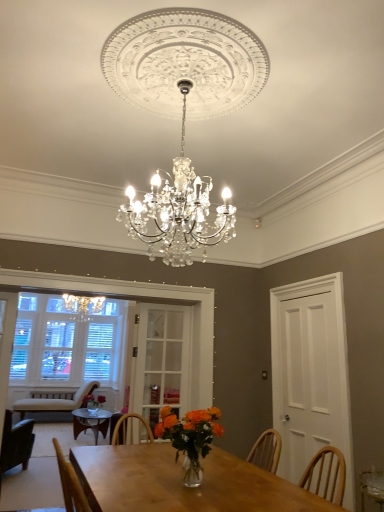
Describe the element at coordinates (190, 438) in the screenshot. I see `translucent glass vase at center` at that location.

The image size is (384, 512). Find the location of `dark green fabric chair at left, the 2th chair from the back`. dark green fabric chair at left, the 2th chair from the back is located at coordinates (16, 443).

This screenshot has height=512, width=384. What do you see at coordinates (16, 443) in the screenshot?
I see `dark green fabric chair at left, the 1th chair viewed from the top` at bounding box center [16, 443].

What is the approximate height of clear glass door at center, which appears as the first glass door when viewed from the left?

1.46 meters.

Locate an element on the screen. The image size is (384, 512). beige fabric chair at left, which ranks as the first chair in back-to-front order is located at coordinates (54, 401).

At what (x,y) coordinates should I click in order to perform the action: click on translucent glass vase at center. Please return your answer as a coordinate pair (x, y). The height and width of the screenshot is (512, 384). Looking at the image, I should click on (190, 438).

Is beige fabric chair at left, which is the first chair in bottom-to-top order, inside translucent glass vase at center?

That's incorrect, beige fabric chair at left, which is the first chair in bottom-to-top order, is not inside translucent glass vase at center.

From their relative heights in the image, would you say translucent glass vase at center is taller or shorter than beige fabric chair at left, which is counted as the second chair, starting from the top?

translucent glass vase at center is shorter than beige fabric chair at left, which is counted as the second chair, starting from the top.

Image resolution: width=384 pixels, height=512 pixels. In order to click on floral arrangement above the beige fabric chair at left, acting as the 2th chair starting from the front (from a real-world perspective) in this screenshot , I will do `click(190, 438)`.

Can you tell me how much translucent glass vase at center and beige fabric chair at left, which ranks as the first chair in back-to-front order, differ in facing direction?

179 degrees.

Visually, is white wood door at right, positioned as the second glass door in left-to-right order, positioned to the left or to the right of beige fabric chair at left, which is the first chair in bottom-to-top order?

Based on their positions, white wood door at right, positioned as the second glass door in left-to-right order, is located to the right of beige fabric chair at left, which is the first chair in bottom-to-top order.

Between point (284, 432) and point (33, 394), which one is positioned in front?

The point (284, 432) is closer to the camera.

Which object is wider, white wood door at right, positioned as the second glass door in left-to-right order, or beige fabric chair at left, which is counted as the second chair, starting from the top?

beige fabric chair at left, which is counted as the second chair, starting from the top.

From the picture: Are white wood door at right, positioned as the second glass door in left-to-right order, and beige fabric chair at left, which is counted as the second chair, starting from the top, located far from each other?

Yes, white wood door at right, positioned as the second glass door in left-to-right order, is far from beige fabric chair at left, which is counted as the second chair, starting from the top.

From the image's perspective, relative to dark green fabric chair at left, the 2th chair when ordered from bottom to top, is white wood door at right, placed as the 1th glass door when sorted from right to left, above or below?

white wood door at right, placed as the 1th glass door when sorted from right to left, is situated higher than dark green fabric chair at left, the 2th chair when ordered from bottom to top, in the image.

What's the angular difference between white wood door at right, positioned as the second glass door in left-to-right order, and dark green fabric chair at left, which appears as the first chair when viewed from the front,'s facing directions?

white wood door at right, positioned as the second glass door in left-to-right order, and dark green fabric chair at left, which appears as the first chair when viewed from the front, are facing 116 degrees away from each other.

Does point (348, 446) come in front of point (20, 459)?

Yes, point (348, 446) is in front of point (20, 459).

Which is more to the right, white wood door at right, positioned as the second glass door in left-to-right order, or dark green fabric chair at left, the 2th chair when ordered from bottom to top?

white wood door at right, positioned as the second glass door in left-to-right order, is more to the right.

From a real-world perspective, is clear glass door at center, which appears as the first glass door when viewed from the left, located higher than translucent glass vase at center?

Indeed, from a real-world perspective, clear glass door at center, which appears as the first glass door when viewed from the left, stands above translucent glass vase at center.

In the scene shown: Which object is closer to the camera taking this photo, clear glass door at center, which appears as the first glass door when viewed from the left, or translucent glass vase at center?

translucent glass vase at center is closer to the camera.

Is point (177, 407) positioned before point (199, 420)?

No, (177, 407) is behind (199, 420).

Considering the sizes of objects clear glass door at center, which appears as the first glass door when viewed from the left, and translucent glass vase at center in the image provided, who is taller, clear glass door at center, which appears as the first glass door when viewed from the left, or translucent glass vase at center?

clear glass door at center, which appears as the first glass door when viewed from the left.

In the scene shown: Considering the relative sizes of dark green fabric chair at left, the 2th chair from the back, and clear glass door at center, which appears as the first glass door when viewed from the left, in the image provided, is dark green fabric chair at left, the 2th chair from the back, bigger than clear glass door at center, which appears as the first glass door when viewed from the left,?

Indeed, dark green fabric chair at left, the 2th chair from the back, has a larger size compared to clear glass door at center, which appears as the first glass door when viewed from the left.

Is dark green fabric chair at left, the 1th chair viewed from the top, closer to the viewer compared to clear glass door at center, which appears as the 2th glass door when viewed from the right?

No, dark green fabric chair at left, the 1th chair viewed from the top, is behind clear glass door at center, which appears as the 2th glass door when viewed from the right.

From a real-world perspective, who is located higher, dark green fabric chair at left, the 2th chair from the back, or clear glass door at center, which appears as the 2th glass door when viewed from the right?

clear glass door at center, which appears as the 2th glass door when viewed from the right.

Is the surface of dark green fabric chair at left, the 2th chair from the back, in direct contact with clear glass door at center, which appears as the 2th glass door when viewed from the right?

dark green fabric chair at left, the 2th chair from the back, is not next to clear glass door at center, which appears as the 2th glass door when viewed from the right, and they're not touching.

Considering the relative sizes of dark green fabric chair at left, the 1th chair viewed from the top, and beige fabric chair at left, which ranks as the first chair in back-to-front order, in the image provided, is dark green fabric chair at left, the 1th chair viewed from the top, bigger than beige fabric chair at left, which ranks as the first chair in back-to-front order,?

No.

From a real-world perspective, is dark green fabric chair at left, the 2th chair when ordered from bottom to top, positioned above or below beige fabric chair at left, which is counted as the second chair, starting from the top?

dark green fabric chair at left, the 2th chair when ordered from bottom to top, is above beige fabric chair at left, which is counted as the second chair, starting from the top.

Considering the positions of points (24, 431) and (76, 405), is point (24, 431) farther from camera compared to point (76, 405)?

That is False.

Is dark green fabric chair at left, the 2th chair when ordered from bottom to top, taller or shorter than beige fabric chair at left, which is counted as the second chair, starting from the top?

In the image, dark green fabric chair at left, the 2th chair when ordered from bottom to top, appears to be taller than beige fabric chair at left, which is counted as the second chair, starting from the top.

From the image's perspective, who appears lower, beige fabric chair at left, which is the first chair in bottom-to-top order, or clear glass door at center, which appears as the 2th glass door when viewed from the right?

beige fabric chair at left, which is the first chair in bottom-to-top order, from the image's perspective.

Between beige fabric chair at left, acting as the 2th chair starting from the front, and clear glass door at center, which appears as the first glass door when viewed from the left, which one has smaller width?

clear glass door at center, which appears as the first glass door when viewed from the left.

In the scene shown: Is the position of beige fabric chair at left, acting as the 2th chair starting from the front, more distant than that of clear glass door at center, which appears as the 2th glass door when viewed from the right?

Yes, it is.

Are beige fabric chair at left, acting as the 2th chair starting from the front, and clear glass door at center, which appears as the 2th glass door when viewed from the right, located far from each other?

beige fabric chair at left, acting as the 2th chair starting from the front, is positioned a significant distance from clear glass door at center, which appears as the 2th glass door when viewed from the right.

Locate an element on the screen. floral arrangement in front of the beige fabric chair at left, which ranks as the first chair in back-to-front order is located at coordinates (190, 438).

There is a beige fabric chair at left, which is the first chair in bottom-to-top order. At what (x,y) coordinates should I click in order to perform the action: click on the 2nd glass door above it (from the image's perspective). Please return your answer as a coordinate pair (x, y). The image size is (384, 512). Looking at the image, I should click on (311, 375).

Which object lies further to the anchor point translucent glass vase at center, beige fabric chair at left, acting as the 2th chair starting from the front, or white wood door at right, placed as the 1th glass door when sorted from right to left?

Among the two, beige fabric chair at left, acting as the 2th chair starting from the front, is located further to translucent glass vase at center.

Based on their spatial positions, is dark green fabric chair at left, which appears as the first chair when viewed from the front, or beige fabric chair at left, which ranks as the first chair in back-to-front order, further from clear glass door at center, which appears as the 2th glass door when viewed from the right?

Based on the image, beige fabric chair at left, which ranks as the first chair in back-to-front order, appears to be further to clear glass door at center, which appears as the 2th glass door when viewed from the right.

Considering their positions, is beige fabric chair at left, which is counted as the second chair, starting from the top, positioned further to dark green fabric chair at left, the 2th chair from the back, than clear glass door at center, which appears as the first glass door when viewed from the left?

The object further to dark green fabric chair at left, the 2th chair from the back, is clear glass door at center, which appears as the first glass door when viewed from the left.

Estimate the real-world distances between objects in this image. Which object is closer to clear glass door at center, which appears as the first glass door when viewed from the left, beige fabric chair at left, which is counted as the second chair, starting from the top, or white wood door at right, positioned as the second glass door in left-to-right order?

white wood door at right, positioned as the second glass door in left-to-right order.

Estimate the real-world distances between objects in this image. Which object is closer to white wood door at right, placed as the 1th glass door when sorted from right to left, clear glass door at center, which appears as the first glass door when viewed from the left, or translucent glass vase at center?

clear glass door at center, which appears as the first glass door when viewed from the left, lies closer to white wood door at right, placed as the 1th glass door when sorted from right to left, than the other object.

Estimate the real-world distances between objects in this image. Which object is further from dark green fabric chair at left, the 1th chair viewed from the top, beige fabric chair at left, which is the first chair in bottom-to-top order, or white wood door at right, placed as the 1th glass door when sorted from right to left?

white wood door at right, placed as the 1th glass door when sorted from right to left, is further to dark green fabric chair at left, the 1th chair viewed from the top.

When comparing their distances from white wood door at right, positioned as the second glass door in left-to-right order, does dark green fabric chair at left, the 2th chair when ordered from bottom to top, or beige fabric chair at left, acting as the 2th chair starting from the front, seem further?

The object further to white wood door at right, positioned as the second glass door in left-to-right order, is beige fabric chair at left, acting as the 2th chair starting from the front.

Estimate the real-world distances between objects in this image. Which object is closer to beige fabric chair at left, which ranks as the first chair in back-to-front order, white wood door at right, placed as the 1th glass door when sorted from right to left, or clear glass door at center, which appears as the 2th glass door when viewed from the right?

Among the two, clear glass door at center, which appears as the 2th glass door when viewed from the right, is located nearer to beige fabric chair at left, which ranks as the first chair in back-to-front order.

Where is `glass door between translucent glass vase at center and clear glass door at center, which appears as the first glass door when viewed from the left, along the z-axis`? The image size is (384, 512). glass door between translucent glass vase at center and clear glass door at center, which appears as the first glass door when viewed from the left, along the z-axis is located at coordinates tap(311, 375).

Identify the location of chair located between translucent glass vase at center and beige fabric chair at left, which is counted as the second chair, starting from the top, in the depth direction. This screenshot has height=512, width=384. (16, 443).

Where is `glass door located between white wood door at right, positioned as the second glass door in left-to-right order, and beige fabric chair at left, which is counted as the second chair, starting from the top, in the depth direction`? This screenshot has width=384, height=512. glass door located between white wood door at right, positioned as the second glass door in left-to-right order, and beige fabric chair at left, which is counted as the second chair, starting from the top, in the depth direction is located at coordinates [162, 360].

Image resolution: width=384 pixels, height=512 pixels. I want to click on chair between white wood door at right, placed as the 1th glass door when sorted from right to left, and beige fabric chair at left, acting as the 2th chair starting from the front, from front to back, so tap(16, 443).